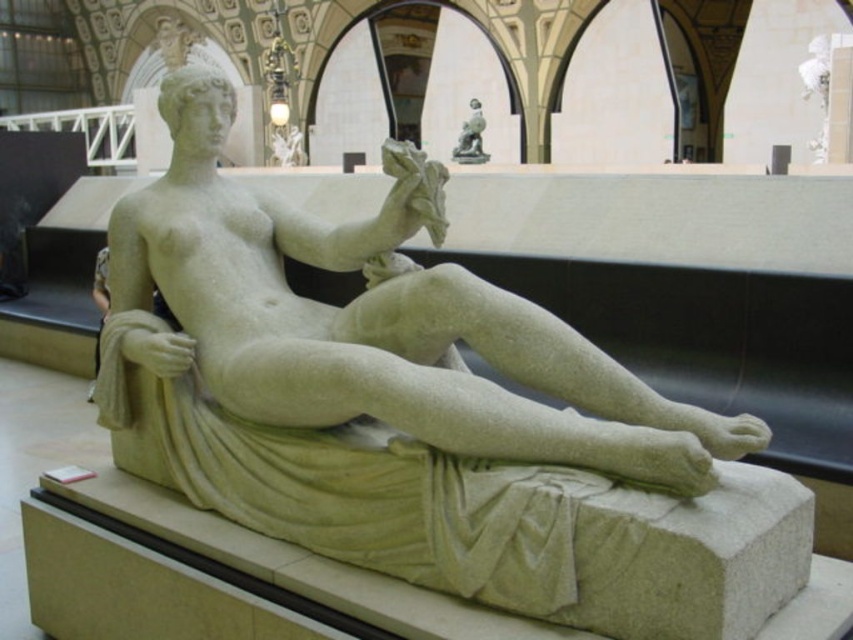
You are an art student standing in front of the sculpture. You notice two statues in the image. Which statue is closer to you, the smooth stone statue at center or the polished bronze statue at upper center?

The smooth stone statue at center is closer to you because it is positioned in front of the polished bronze statue at upper center.

You are an art conservator standing at the entrance of the gallery. You need to move a ladder to reach both the smooth stone statue at center and the polished bronze statue at upper center. Given that the ladder is 45 meters long, will it be long enough to reach both statues from your current position?

The smooth stone statue at center is 46.82 meters away from the polished bronze statue at upper center. Since the ladder is only 45 meters long, it will not be long enough to reach both statues from your current position.

You are an art curator planning to display both the smooth stone statue at center and the polished bronze statue at upper center in a gallery. Given their sizes, which statue should be placed in a more prominent position to highlight its grandeur?

The smooth stone statue at center is bigger than the polished bronze statue at upper center, so it should be placed in a more prominent position to highlight its grandeur.